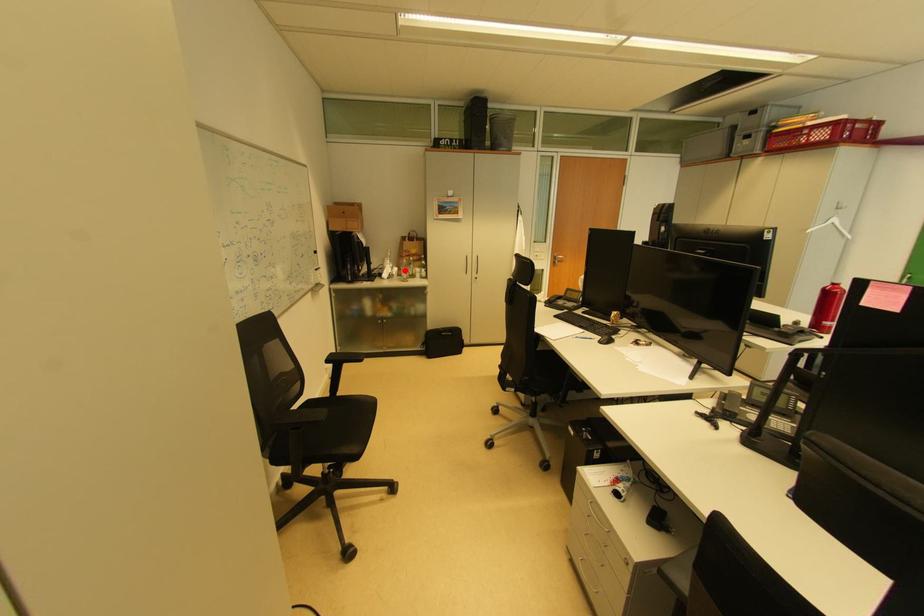
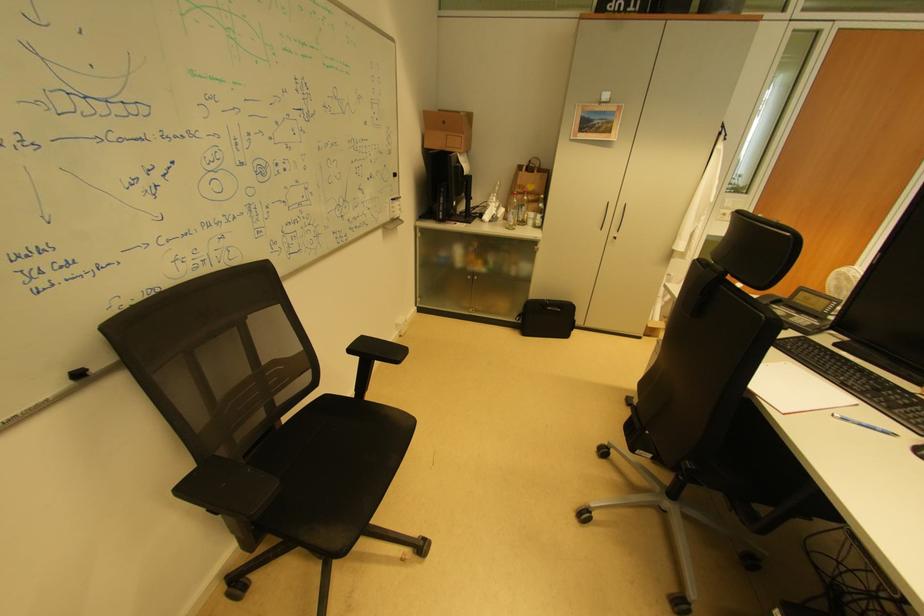
The point at the highlighted location is marked in the first image. Where is the corresponding point in the second image?

(512, 211)